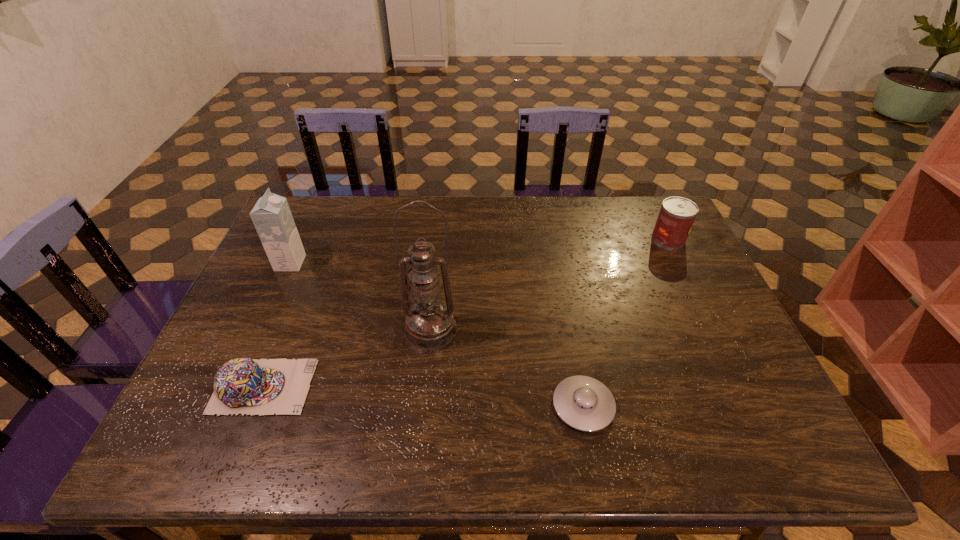
Image resolution: width=960 pixels, height=540 pixels. Find the location of `the third object from left to right`. the third object from left to right is located at coordinates (430, 324).

Identify the location of the tallest object. (430, 324).

You are a GUI agent. You are given a task and a screenshot of the screen. Output one action in this format:
    pyautogui.click(x=<x>, y=<y>)
    Task: Click on the second tallest object
    The image size is (960, 540).
    Given the screenshot: What is the action you would take?
    coord(271,215)

You are a GUI agent. You are given a task and a screenshot of the screen. Output one action in this format:
    pyautogui.click(x=<x>, y=<y>)
    Task: Click on the carton
    
    Given the screenshot: What is the action you would take?
    [x=271, y=215]

I want to click on can, so [676, 217].

You are a GUI agent. You are given a task and a screenshot of the screen. Output one action in this format:
    pyautogui.click(x=<x>, y=<y>)
    Task: Click on the farthest object
    
    Given the screenshot: What is the action you would take?
    pyautogui.click(x=676, y=217)

Where is `the second shortest object`? The image size is (960, 540). the second shortest object is located at coordinates (248, 386).

Find the location of a particular element. The height and width of the screenshot is (540, 960). saucer is located at coordinates (584, 403).

Identify the location of the second object from right to left. (584, 403).

What are the coordinates of `free location located on the left of the oil lamp` in the screenshot? It's located at (x=366, y=329).